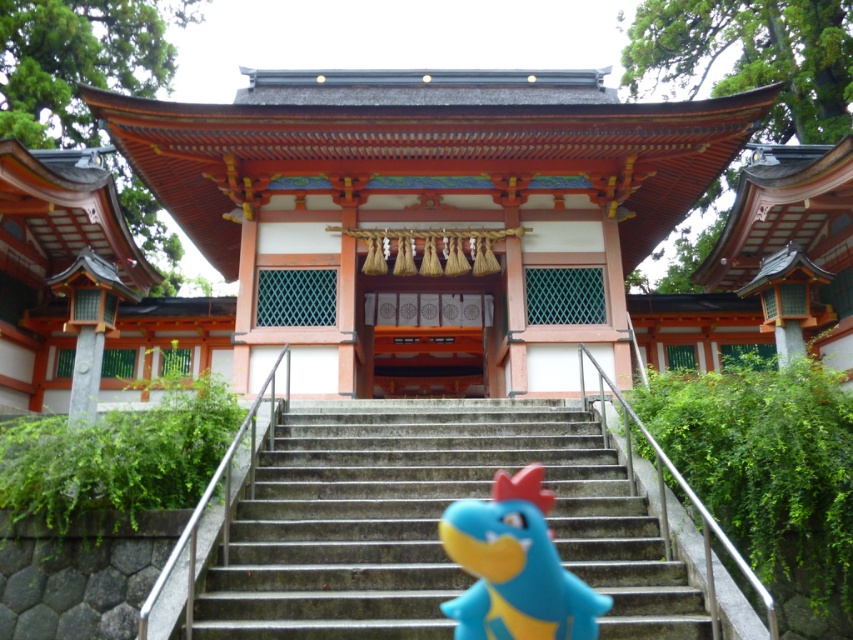
Can you confirm if concrete stairs at center is taller than blue rubber toy at center?

Incorrect, concrete stairs at center's height is not larger of blue rubber toy at center's.

Is concrete stairs at center smaller than blue rubber toy at center?

No.

Is point (397, 476) less distant than point (508, 541)?

No, it is not.

I want to click on concrete stairs at center, so click(426, 522).